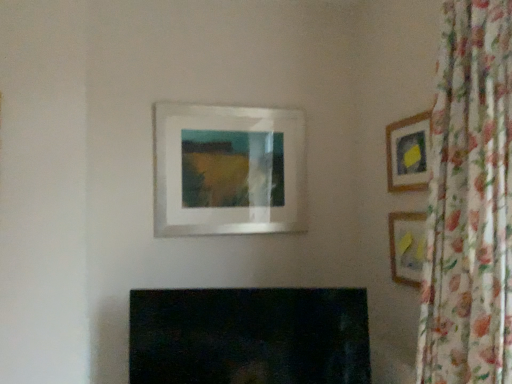
Question: Would you say floral fabric curtain at right contains matte glass picture frame at center, positioned as the 3th picture frame in right-to-left order?

Choices:
 (A) no
 (B) yes

Answer: (A)

Question: Can you confirm if floral fabric curtain at right is positioned to the right of matte glass picture frame at center, positioned as the first picture frame in left-to-right order?

Choices:
 (A) yes
 (B) no

Answer: (A)

Question: Is floral fabric curtain at right located outside matte glass picture frame at center, positioned as the first picture frame in left-to-right order?

Choices:
 (A) no
 (B) yes

Answer: (B)

Question: From the image's perspective, does floral fabric curtain at right appear lower than matte glass picture frame at center, positioned as the 3th picture frame in right-to-left order?

Choices:
 (A) yes
 (B) no

Answer: (A)

Question: From a real-world perspective, is floral fabric curtain at right physically below matte glass picture frame at center, positioned as the 3th picture frame in right-to-left order?

Choices:
 (A) no
 (B) yes

Answer: (B)

Question: Is wooden frame at right, which appears as the 1th picture frame when viewed from the right, taller or shorter than floral fabric curtain at right?

Choices:
 (A) short
 (B) tall

Answer: (A)

Question: In terms of width, does wooden frame at right, which is the 3th picture frame in left-to-right order, look wider or thinner when compared to floral fabric curtain at right?

Choices:
 (A) wide
 (B) thin

Answer: (B)

Question: Is wooden frame at right, which appears as the 1th picture frame when viewed from the right, inside or outside of floral fabric curtain at right?

Choices:
 (A) outside
 (B) inside

Answer: (A)

Question: Considering the relative positions of wooden frame at right, which is the 3th picture frame in left-to-right order, and floral fabric curtain at right in the image provided, is wooden frame at right, which is the 3th picture frame in left-to-right order, to the left or to the right of floral fabric curtain at right?

Choices:
 (A) left
 (B) right

Answer: (B)

Question: Looking at the image, does matte glass picture frame at center, positioned as the 3th picture frame in right-to-left order, seem bigger or smaller compared to floral fabric curtain at right?

Choices:
 (A) big
 (B) small

Answer: (B)

Question: Would you say matte glass picture frame at center, positioned as the 3th picture frame in right-to-left order, is to the left or to the right of floral fabric curtain at right in the picture?

Choices:
 (A) right
 (B) left

Answer: (B)

Question: Is matte glass picture frame at center, positioned as the 3th picture frame in right-to-left order, inside or outside of floral fabric curtain at right?

Choices:
 (A) inside
 (B) outside

Answer: (B)

Question: Is point (156, 125) closer or farther from the camera than point (442, 190)?

Choices:
 (A) farther
 (B) closer

Answer: (A)

Question: From a real-world perspective, is wooden frame at right, which is the 3th picture frame in left-to-right order, positioned above or below wooden frame at upper right, which appears as the second picture frame when viewed from the left?

Choices:
 (A) above
 (B) below

Answer: (B)

Question: Considering the positions of wooden frame at right, which is the 3th picture frame in left-to-right order, and wooden frame at upper right, which appears as the second picture frame when viewed from the left, in the image, is wooden frame at right, which is the 3th picture frame in left-to-right order, wider or thinner than wooden frame at upper right, which appears as the second picture frame when viewed from the left,?

Choices:
 (A) wide
 (B) thin

Answer: (A)